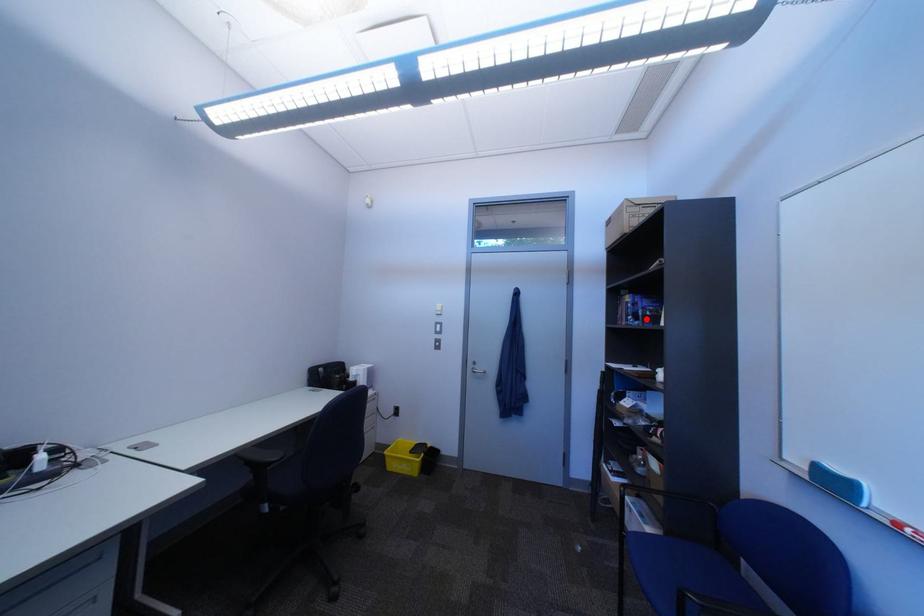
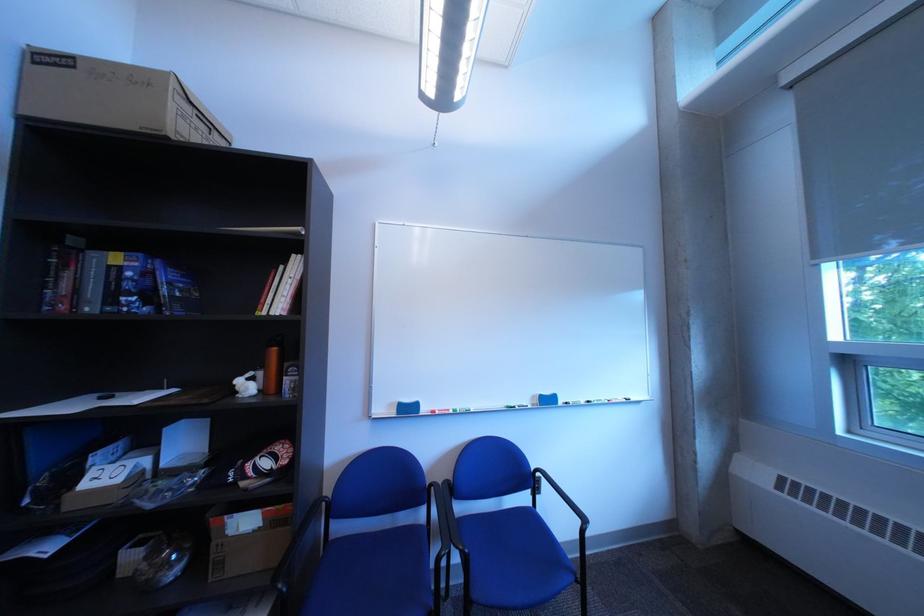
Where in the second image is the point corresponding to the highlighted location from the first image?

(150, 300)